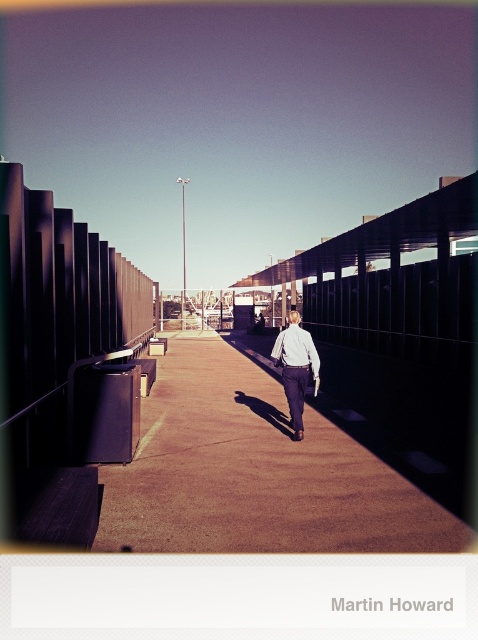
Is point (366, 481) less distant than point (281, 356)?

Yes, it is in front of point (281, 356).

Can you confirm if brown concrete pavement at center is smaller than white shirt at center?

Incorrect, brown concrete pavement at center is not smaller in size than white shirt at center.

The width and height of the screenshot is (478, 640). Describe the element at coordinates (256, 472) in the screenshot. I see `brown concrete pavement at center` at that location.

Identify the location of brown concrete pavement at center. This screenshot has width=478, height=640. (256, 472).

Is point (294, 353) closer to camera compared to point (283, 340)?

Yes, it is.

Locate an element on the screen. The width and height of the screenshot is (478, 640). white shirt at center is located at coordinates (295, 368).

The image size is (478, 640). In order to click on white shirt at center in this screenshot , I will do `click(295, 368)`.

From the picture: Which is more to the right, brown concrete pavement at center or white matte shirt at center?

white matte shirt at center is more to the right.

Is brown concrete pavement at center above white matte shirt at center?

Incorrect, brown concrete pavement at center is not positioned above white matte shirt at center.

Where is `brown concrete pavement at center`? The height and width of the screenshot is (640, 478). brown concrete pavement at center is located at coordinates (256, 472).